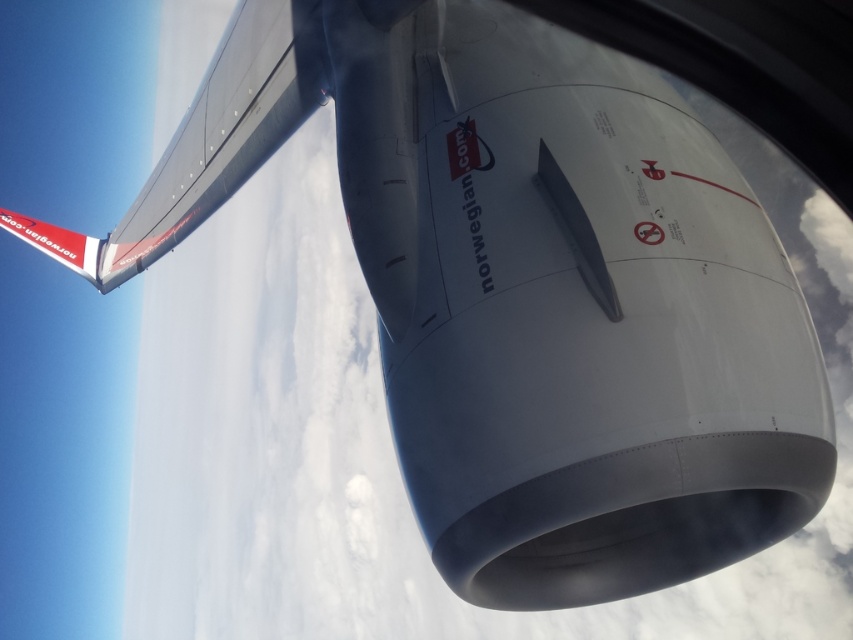
Who is shorter, polished metallic wing at upper left or white glossy tail at upper left?

With less height is white glossy tail at upper left.

Measure the distance between polished metallic wing at upper left and white glossy tail at upper left.

polished metallic wing at upper left and white glossy tail at upper left are 76.85 feet apart from each other.

Is point (283, 122) positioned in front of point (22, 236)?

Yes, point (283, 122) is in front of point (22, 236).

Identify the location of polished metallic wing at upper left. (225, 129).